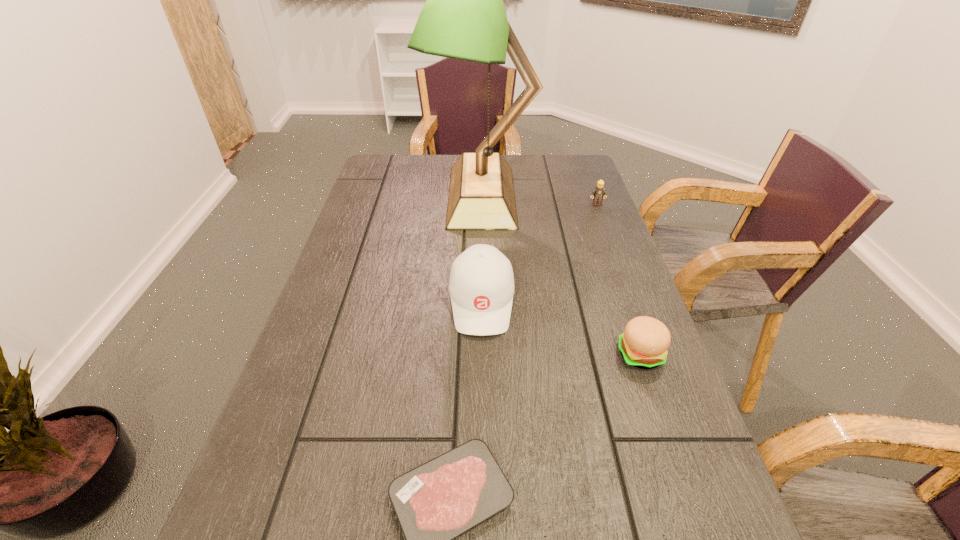
This screenshot has height=540, width=960. I want to click on vacant point located between the Lego and the hamburger, so click(x=618, y=279).

Find the location of a particular element. free space between the Lego and the tallest object is located at coordinates (540, 200).

The height and width of the screenshot is (540, 960). In order to click on free spot between the hamburger and the second tallest object in this screenshot , I will do `click(561, 328)`.

Identify the location of object that is the fourth closest to the tallest object. This screenshot has height=540, width=960. (439, 500).

This screenshot has width=960, height=540. What are the coordinates of `object that stands as the closest to the shortest object` in the screenshot? It's located at (481, 286).

The height and width of the screenshot is (540, 960). Identify the location of vacant position in the image that satisfies the following two spatial constraints: 1. on the front-facing side of the hamburger; 2. on the right side of the baseball cap. (482, 355).